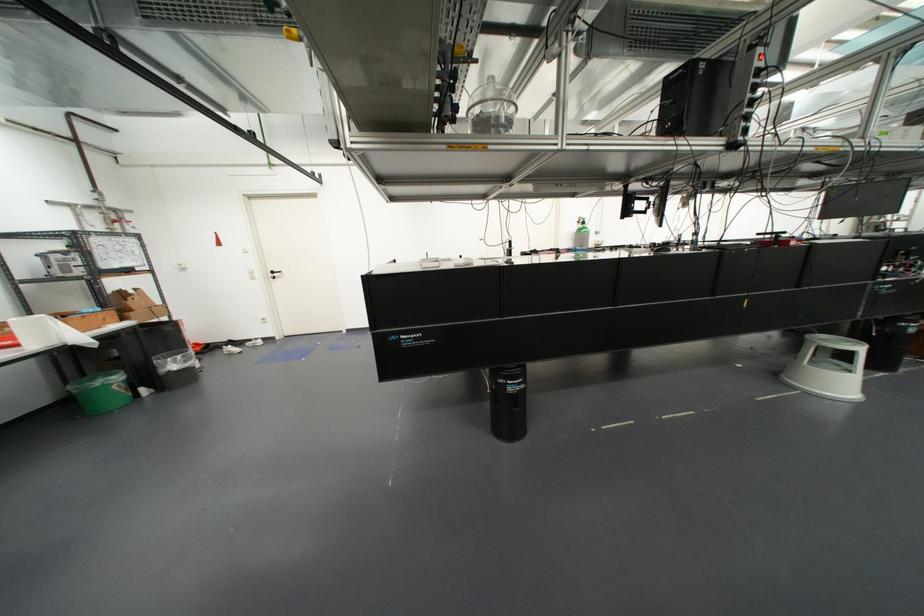
Locate an element on the screen. The height and width of the screenshot is (616, 924). green bucket is located at coordinates (101, 392).